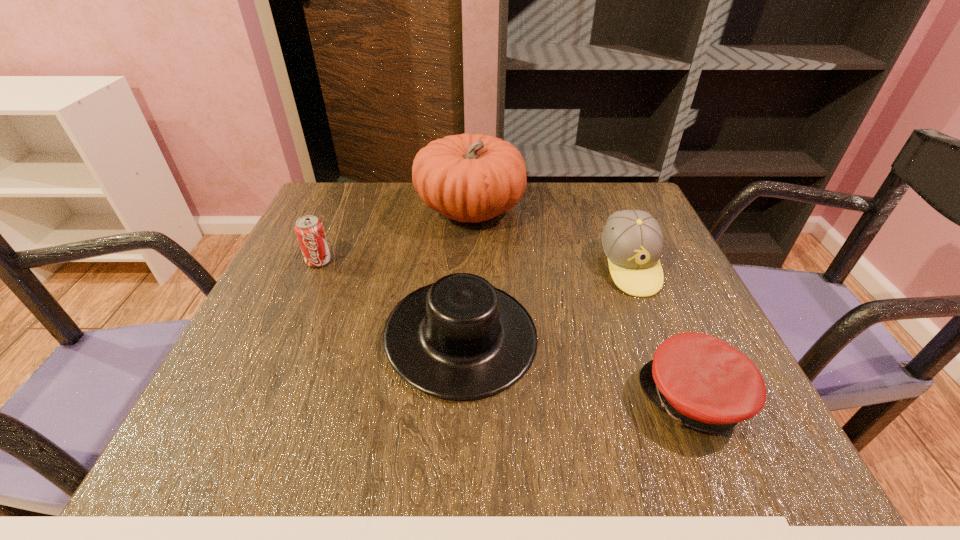
Identify the location of vacant space located 0.290m at the front of the cap where the visor is located. (460, 399).

The height and width of the screenshot is (540, 960). I want to click on vacant space situated at the front of the cap where the visor is located, so click(402, 399).

Image resolution: width=960 pixels, height=540 pixels. In order to click on object that is at the far edge in this screenshot , I will do `click(468, 177)`.

Locate an element on the screen. object at the near edge is located at coordinates (702, 382).

The height and width of the screenshot is (540, 960). I want to click on object located at the left edge, so click(x=309, y=229).

Locate an element on the screen. baseball cap that is at the right edge is located at coordinates (632, 240).

At what (x,y) coordinates should I click in order to perform the action: click on cap positioned at the right edge. Please return your answer as a coordinate pair (x, y). Looking at the image, I should click on coord(702,382).

Find the location of `object positioned at the near right corner`. object positioned at the near right corner is located at coordinates (702, 382).

The image size is (960, 540). Identify the location of free space at the far edge. (456, 227).

The width and height of the screenshot is (960, 540). In order to click on vacant space at the near edge of the desktop in this screenshot , I will do `click(506, 419)`.